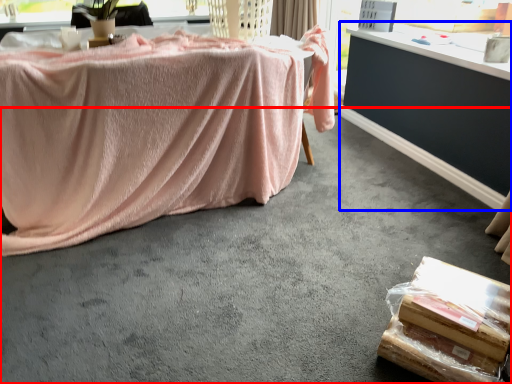
Question: Among these objects, which one is nearest to the camera, concrete (highlighted by a red box) or table (highlighted by a blue box)?

Choices:
 (A) concrete
 (B) table

Answer: (A)